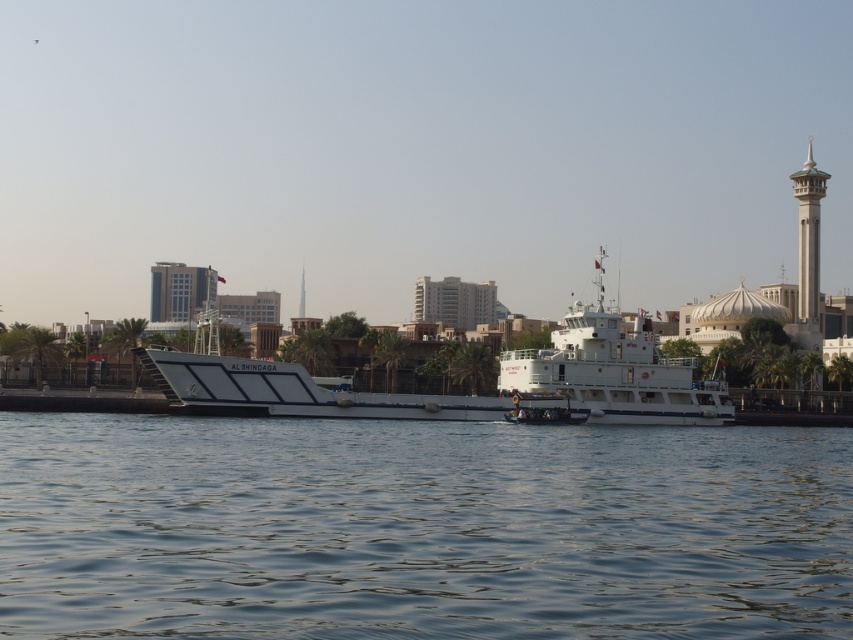
Which is above, clear water at center or white matte ferry at center?

white matte ferry at center is higher up.

Does point (822, 636) come behind point (648, 360)?

No, it is not.

The height and width of the screenshot is (640, 853). Find the location of `clear water at center`. clear water at center is located at coordinates (421, 529).

Can you confirm if clear water at center is thinner than white matte boat at center?

No.

From the picture: Can you confirm if clear water at center is positioned to the right of white matte boat at center?

Indeed, clear water at center is positioned on the right side of white matte boat at center.

This screenshot has width=853, height=640. In order to click on clear water at center in this screenshot , I will do `click(421, 529)`.

Does white matte ferry at center have a larger size compared to white matte boat at center?

Yes.

Which is in front, point (599, 273) or point (309, 394)?

Point (309, 394) is more forward.

Image resolution: width=853 pixels, height=640 pixels. I want to click on white matte ferry at center, so click(x=613, y=371).